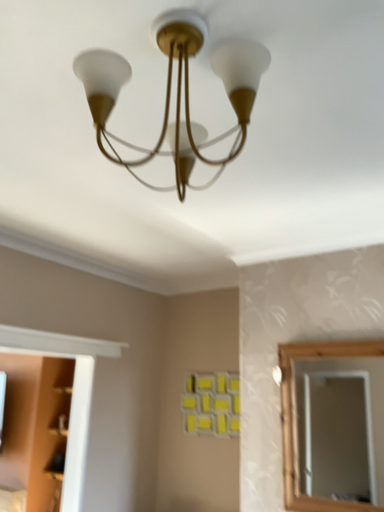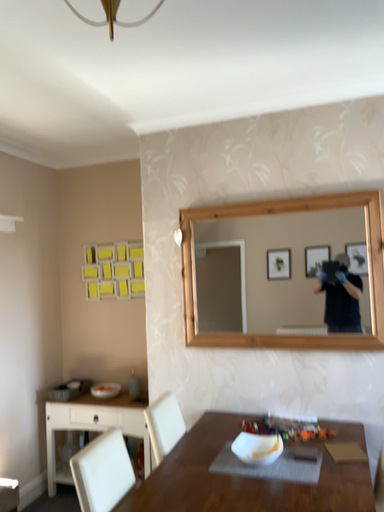
Question: Which way did the camera rotate in the video?

Choices:
 (A) rotated right
 (B) rotated left

Answer: (A)